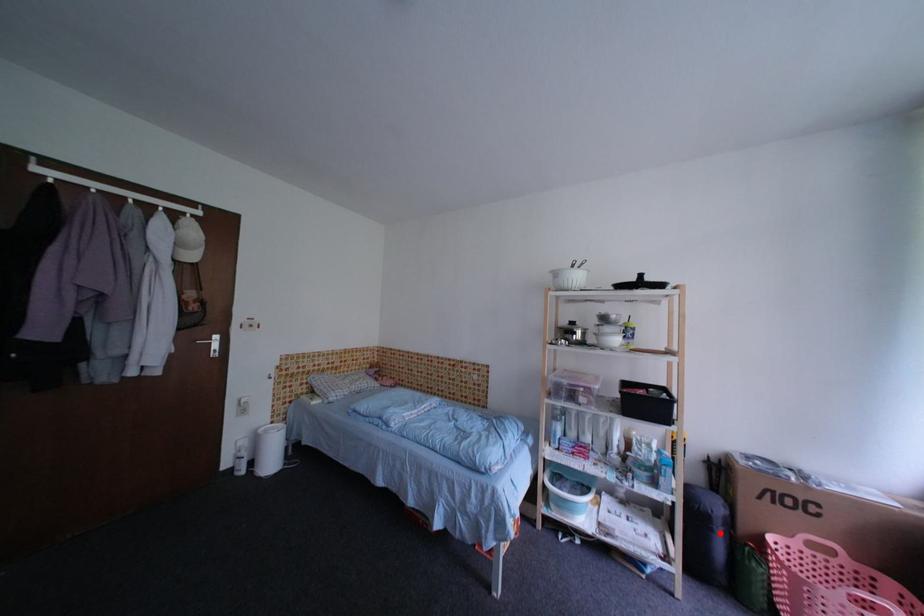
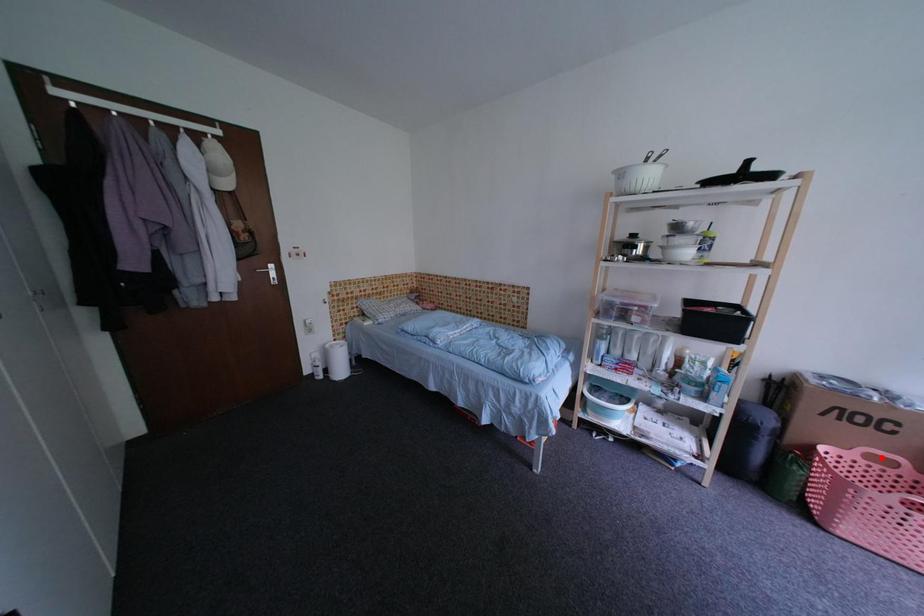
I am providing you with two images of the same scene from different viewpoints. A red point is marked on the first image and another point is marked on the second image. Do the highlighted points in image1 and image2 indicate the same real-world spot?

No